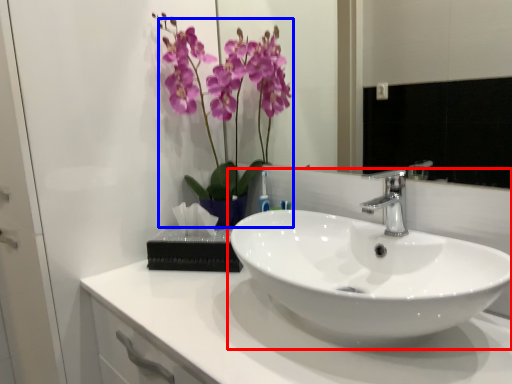
Question: Which point is closer to the camera, sink (highlighted by a red box) or floral arrangement (highlighted by a blue box)?

Choices:
 (A) sink
 (B) floral arrangement

Answer: (A)